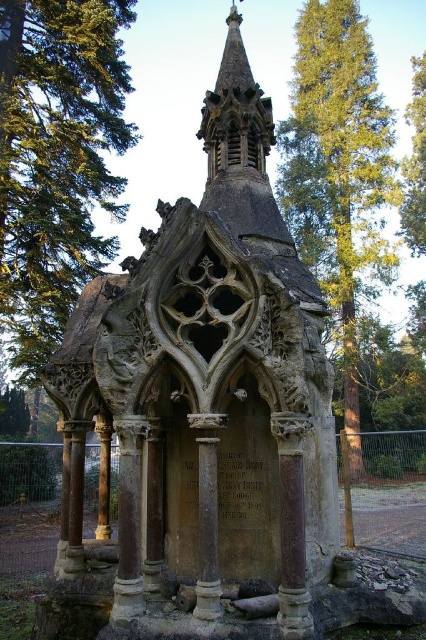
Can you confirm if stone gothic chapel at center is shorter than smooth stone column at lower center?

No, stone gothic chapel at center is not shorter than smooth stone column at lower center.

Which is more to the left, stone gothic chapel at center or smooth stone column at lower center?

smooth stone column at lower center

Find the location of a particular element. This screenshot has height=640, width=426. stone gothic chapel at center is located at coordinates (207, 394).

This screenshot has height=640, width=426. What are the coordinates of `stone gothic chapel at center` in the screenshot? It's located at (207, 394).

Which is behind, point (152, 282) or point (422, 241)?

The point (422, 241) is more distant.

Can you confirm if stone gothic chapel at center is positioned below green leafy tree at upper right?

Yes.

Is point (89, 611) behind point (411, 160)?

No, it is in front of (411, 160).

What are the coordinates of `stone gothic chapel at center` in the screenshot? It's located at (207, 394).

Who is positioned more to the right, stone gothic chapel at center or green leafy tree at upper center?

From the viewer's perspective, green leafy tree at upper center appears more on the right side.

Measure the distance between stone gothic chapel at center and camera.

They are 22.24 feet apart.

I want to click on stone gothic chapel at center, so click(207, 394).